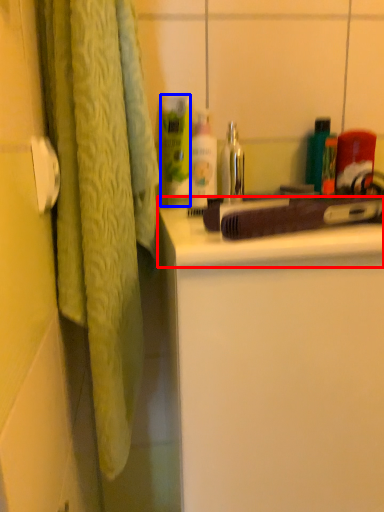
Question: Which object is further to the camera taking this photo, counter top (highlighted by a red box) or cleaning product (highlighted by a blue box)?

Choices:
 (A) counter top
 (B) cleaning product

Answer: (B)